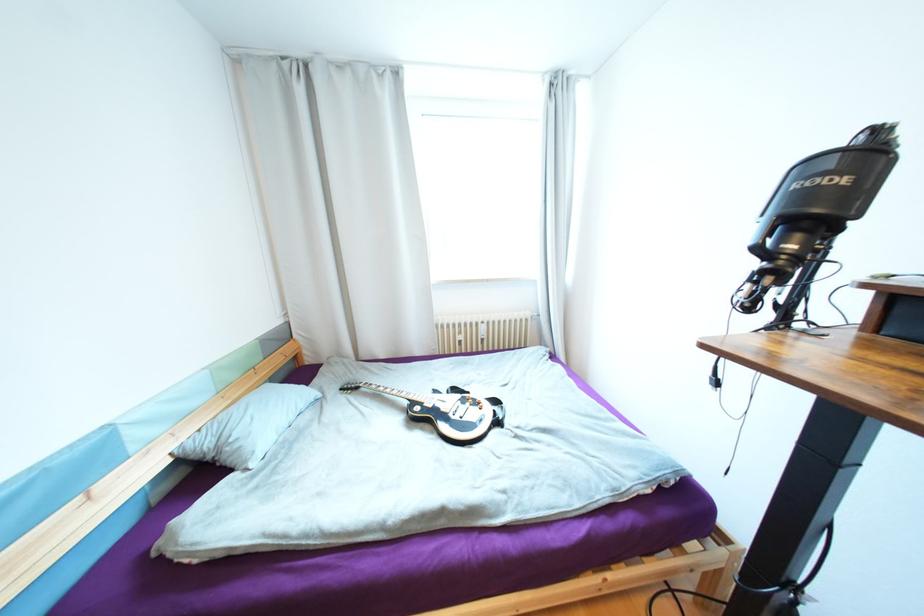
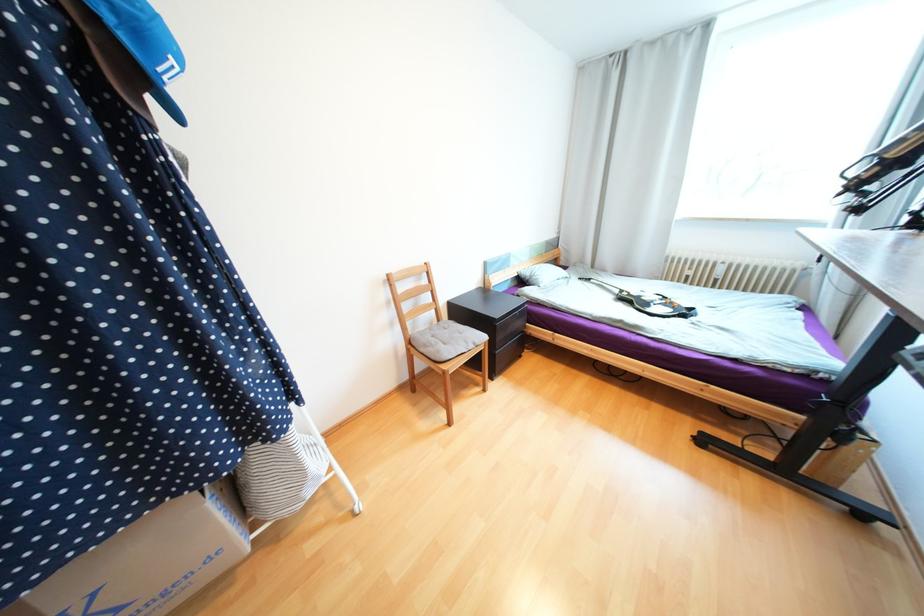
Locate, in the second image, the point that corresponds to point 178,448 in the first image.

(524, 270)